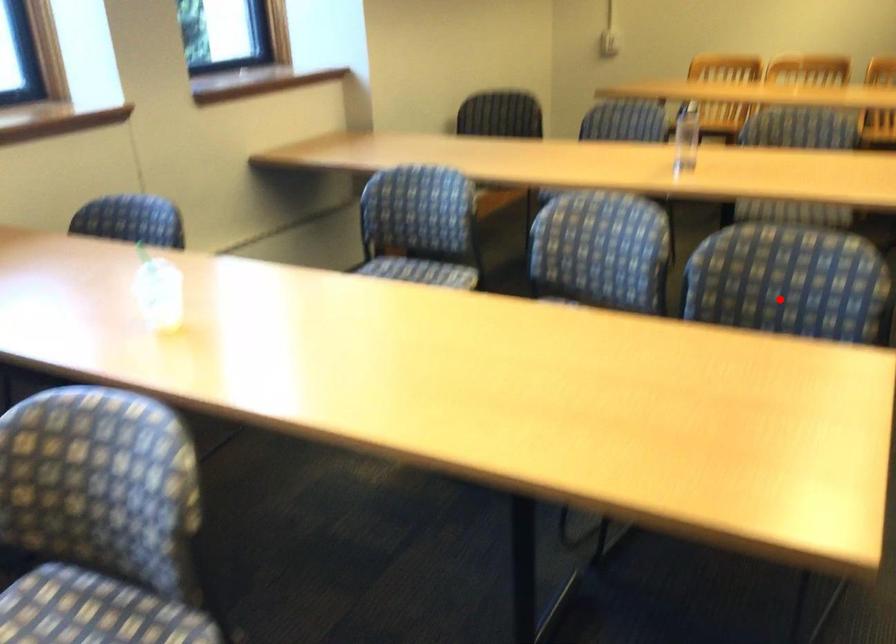
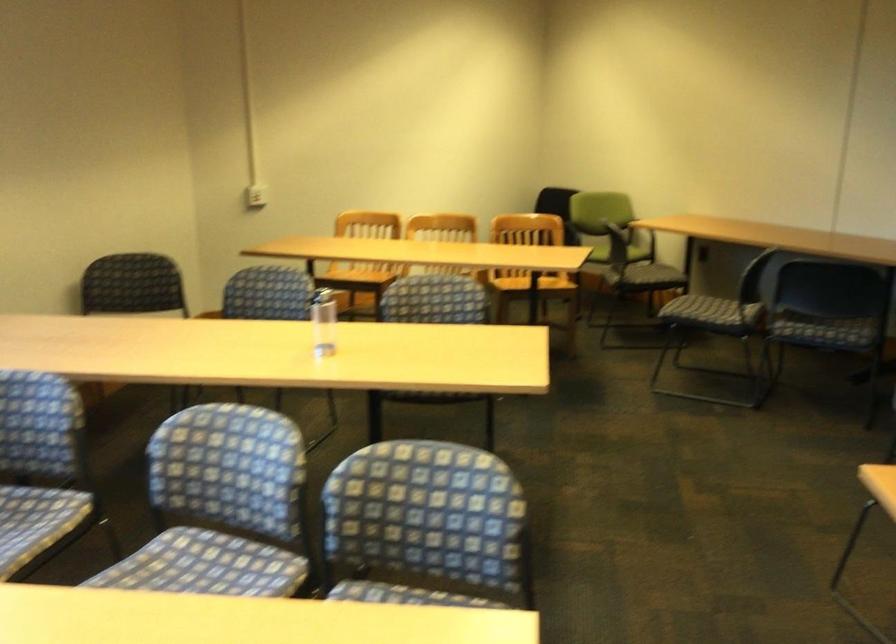
In the second image, find the point that corresponds to the highlighted location in the first image.

(425, 527)